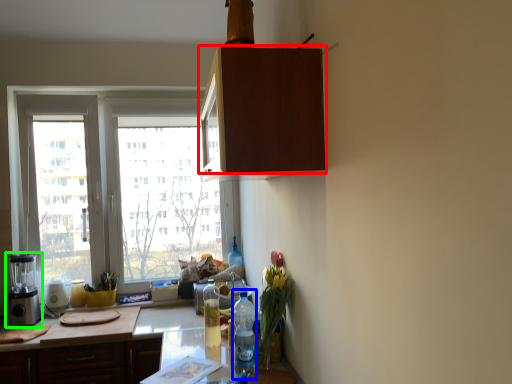
Question: Which object is positioned farthest from cabinetry (highlighted by a red box)? Select from bottle (highlighted by a blue box) and appliance (highlighted by a green box).

Choices:
 (A) bottle
 (B) appliance

Answer: (B)